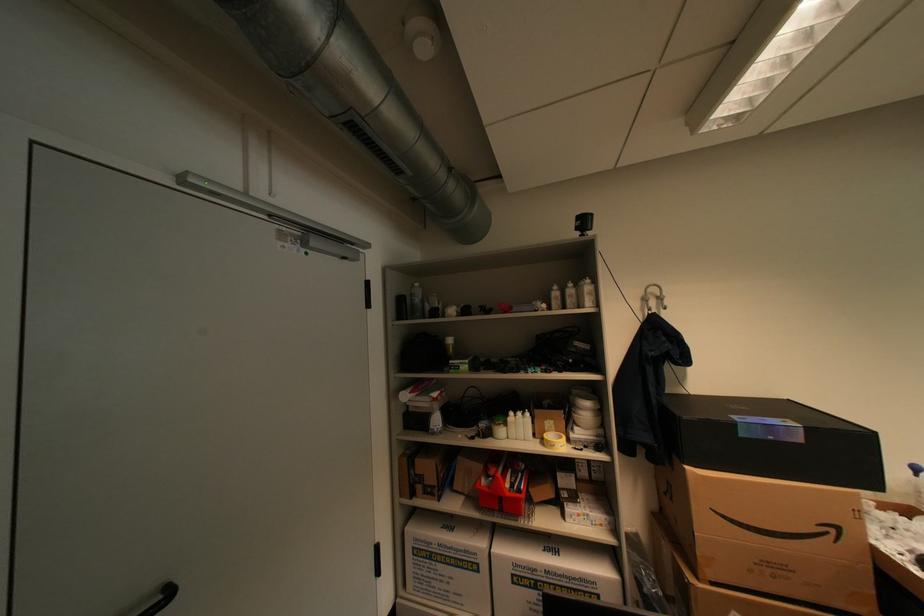
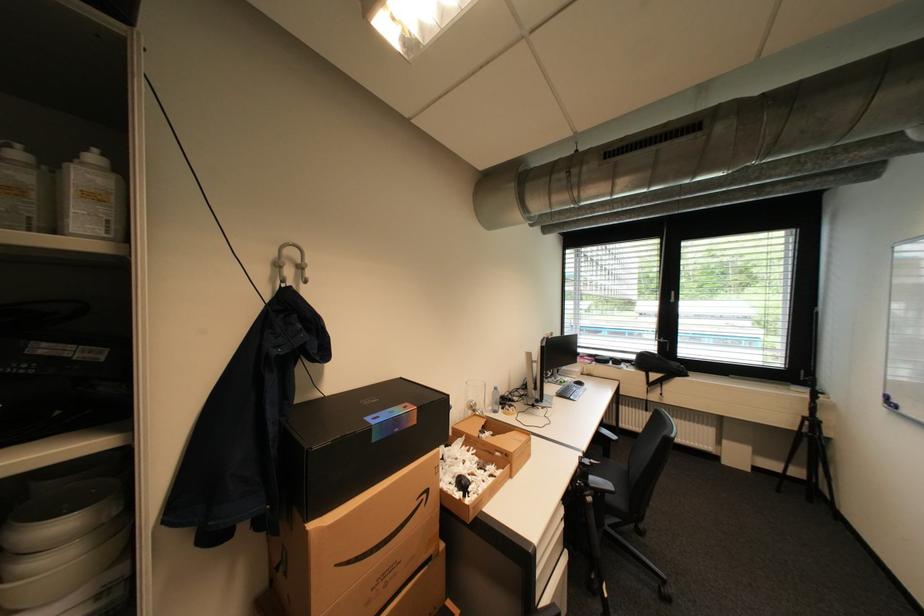
Find the pixel in the second image that matches pixel 598 294 in the first image.

(100, 197)